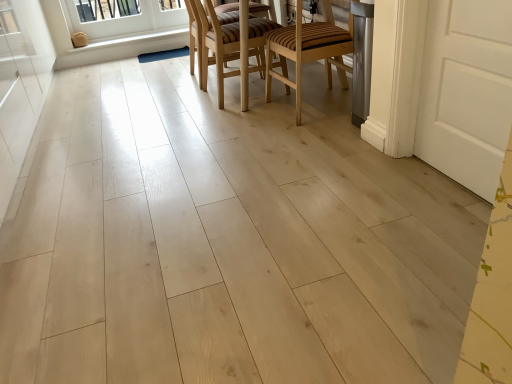
Identify the location of vacant space underneath wooden striped chair at center, which is the 2th chair in left-to-right order (from a real-world perspective). The width and height of the screenshot is (512, 384). (324, 107).